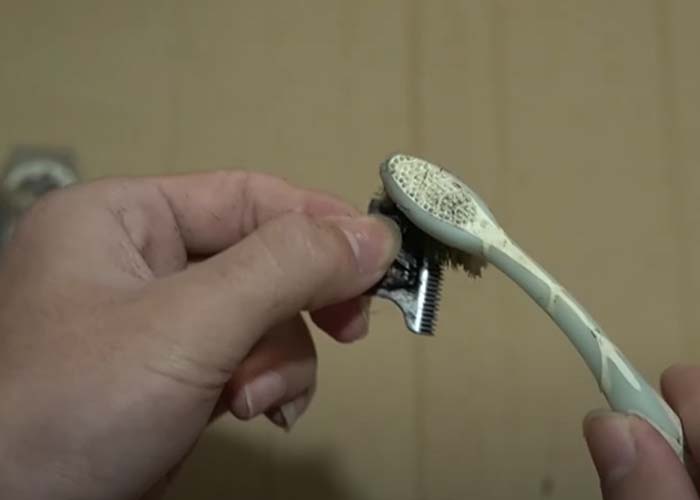
The height and width of the screenshot is (500, 700). I want to click on toothbrush handle, so click(x=591, y=345).